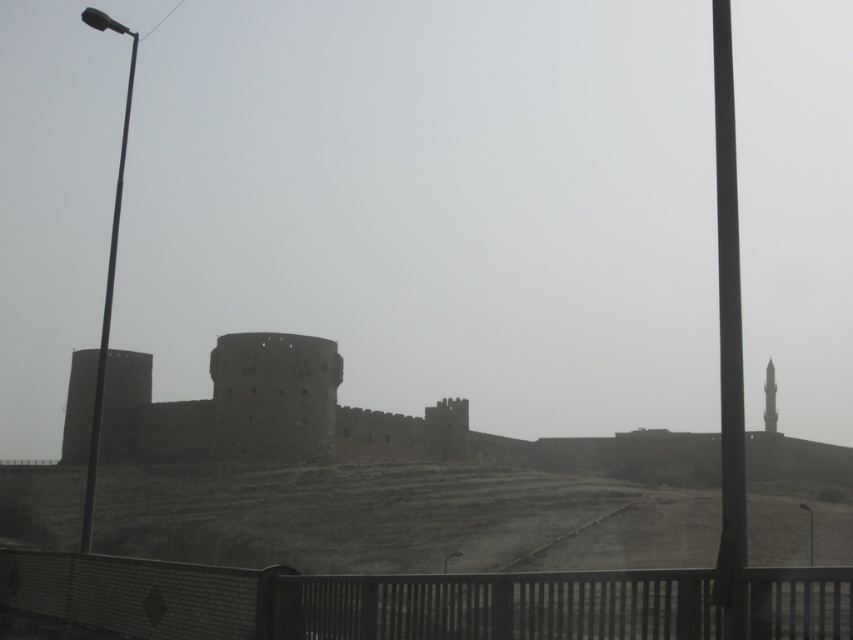
Can you confirm if brick fence at lower center is smaller than brown stone castle at center?

Correct, brick fence at lower center occupies less space than brown stone castle at center.

Does brick fence at lower center have a larger size compared to brown stone castle at center?

Incorrect, brick fence at lower center is not larger than brown stone castle at center.

In order to click on brick fence at lower center in this screenshot , I will do `click(354, 602)`.

Between brick fence at lower center and smooth stone minaret at center, which one appears on the left side from the viewer's perspective?

Positioned to the left is brick fence at lower center.

Can you confirm if brick fence at lower center is bigger than smooth stone minaret at center?

Indeed, brick fence at lower center has a larger size compared to smooth stone minaret at center.

At what (x,y) coordinates should I click in order to perform the action: click on brick fence at lower center. Please return your answer as a coordinate pair (x, y). Looking at the image, I should click on (354, 602).

Locate an element on the screen. The height and width of the screenshot is (640, 853). brick fence at lower center is located at coordinates (354, 602).

Is brown stone castle at center taller than smooth stone minaret at center?

Yes, brown stone castle at center is taller than smooth stone minaret at center.

The image size is (853, 640). I want to click on brown stone castle at center, so click(x=265, y=408).